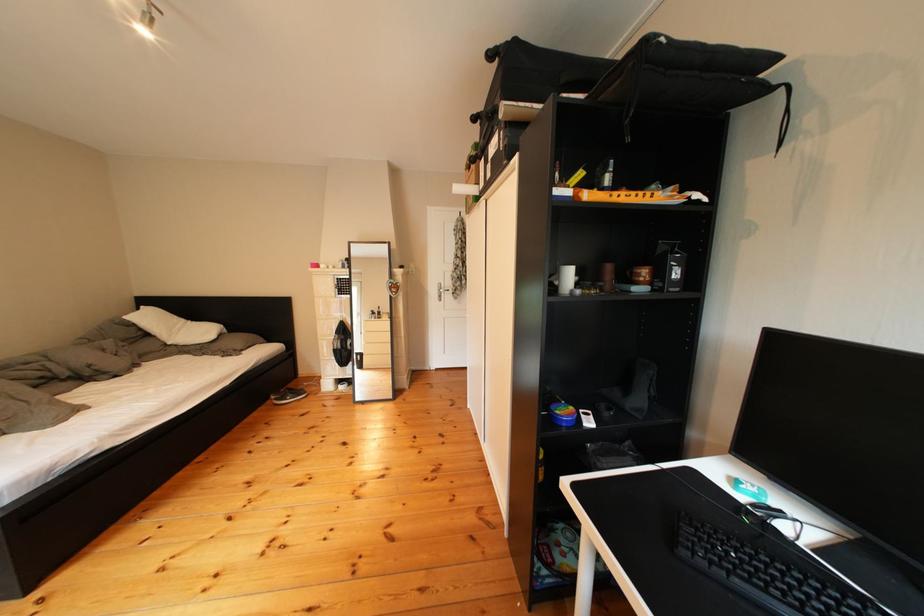
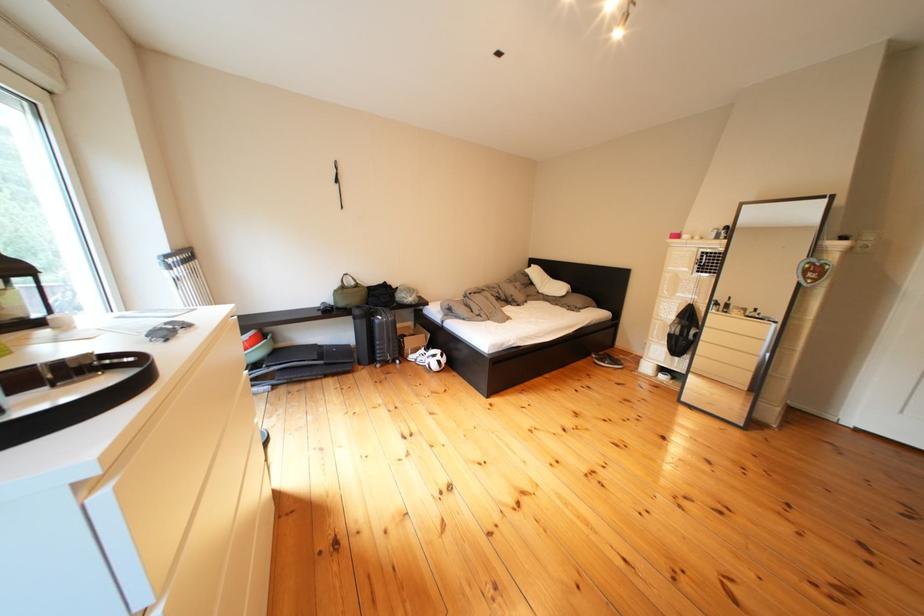
Question: The images are taken continuously from a first-person perspective. In which direction is your viewpoint rotating?

Choices:
 (A) Left
 (B) Right
 (C) Up
 (D) Down

Answer: (A)